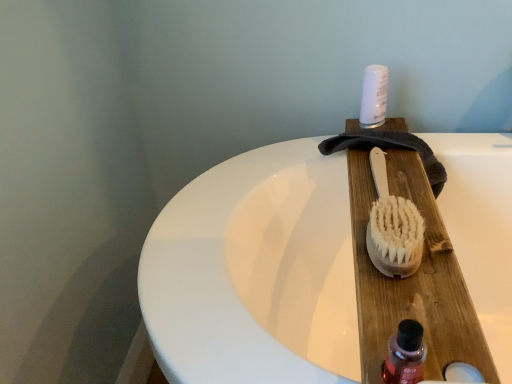
The width and height of the screenshot is (512, 384). I want to click on unoccupied area in front of white plastic canister at upper center, so click(387, 142).